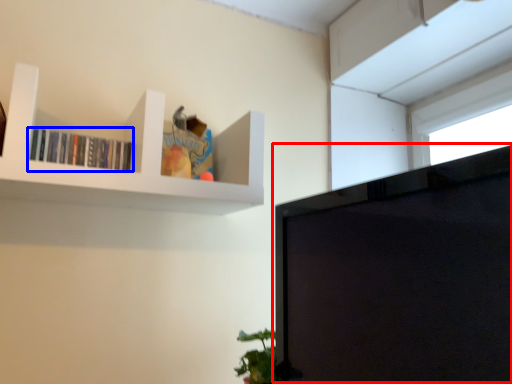
Question: Which object appears farthest to the camera in this image, computer monitor (highlighted by a red box) or book (highlighted by a blue box)?

Choices:
 (A) computer monitor
 (B) book

Answer: (B)